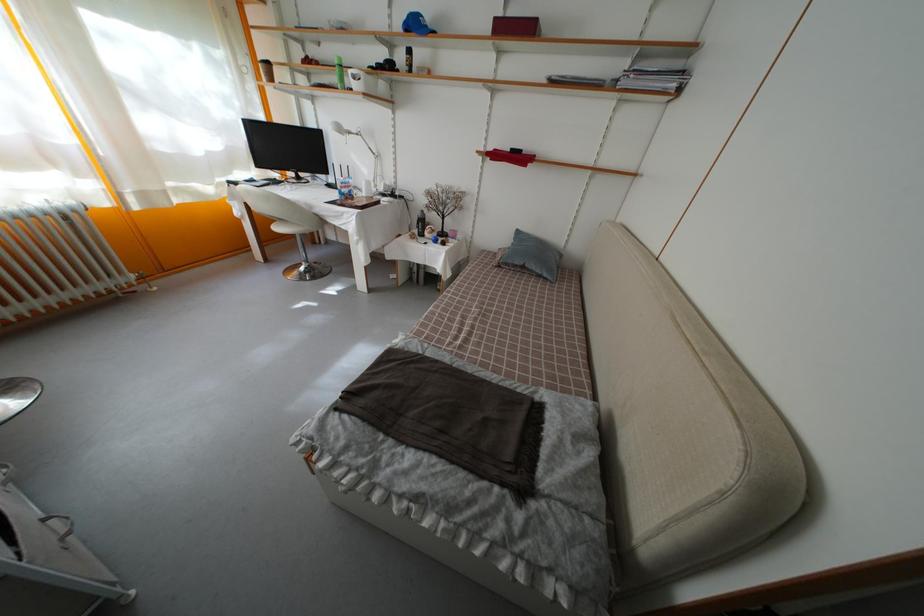
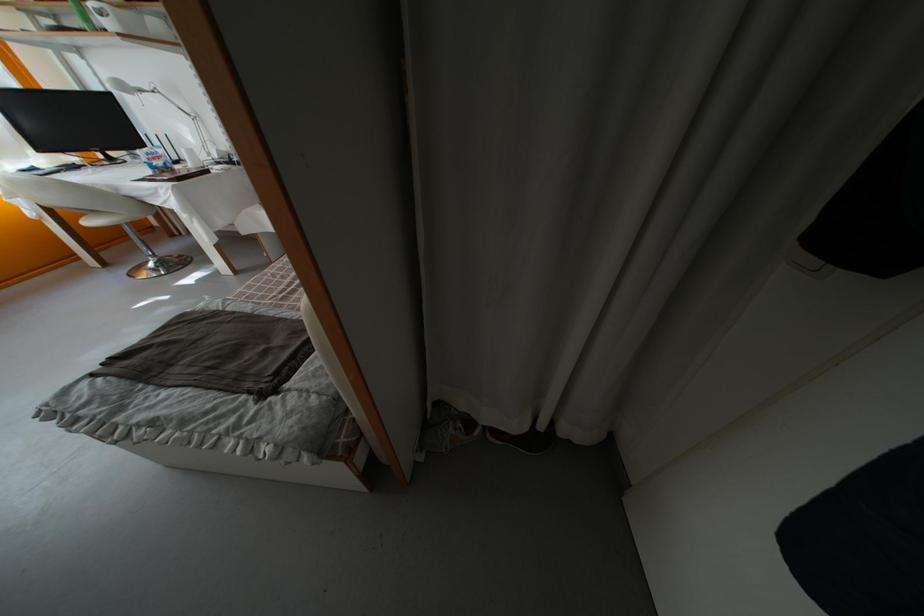
Where in the second image is the point corresponding to point 351,134 from the first image?

(139, 91)